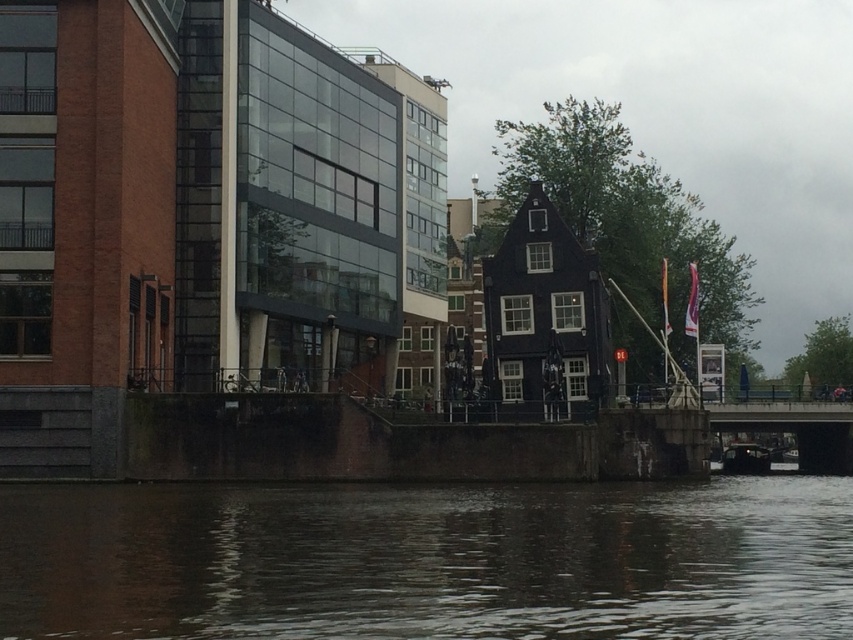
Who is higher up, brown water at lower center or dark brown wooden boat at lower right?

Positioned higher is brown water at lower center.

Which is behind, point (144, 536) or point (726, 451)?

The point (726, 451) is more distant.

Locate an element on the screen. The image size is (853, 640). brown water at lower center is located at coordinates (428, 561).

Where is `brown water at lower center`? The height and width of the screenshot is (640, 853). brown water at lower center is located at coordinates (428, 561).